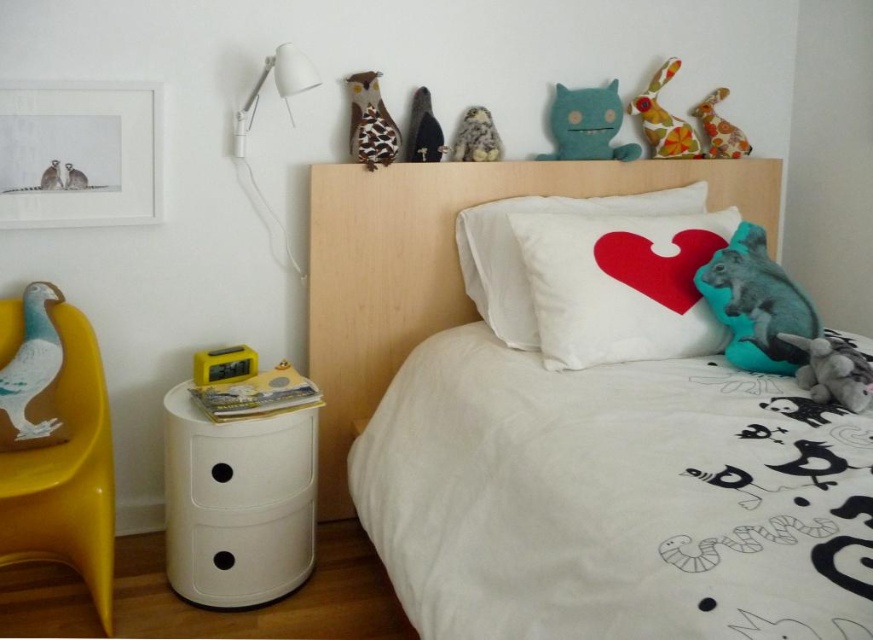
You are arranging a display in the bedroom corner and need to place a new decorative item between the matte blue bird at left and the fuzzy fabric owl at upper center. Based on their positions, where should you place the new item to ensure it doesn

The matte blue bird at left is in front of the fuzzy fabric owl at upper center, so placing the new item between them would require positioning it either in front of the matte blue bird at left or behind the fuzzy fabric owl at upper center to maintain the spatial arrangement.

You are a delivery robot that needs to place a small package between the textured brown owl at upper center and the floral fabric plush rabbit at upper center. Can you fit the package in the space between them if the package is 3 feet wide?

The distance between the textured brown owl at upper center and the floral fabric plush rabbit at upper center is 3.48 feet. Since the package is 3 feet wide, it can fit in the space between them as the distance is greater than the package width.